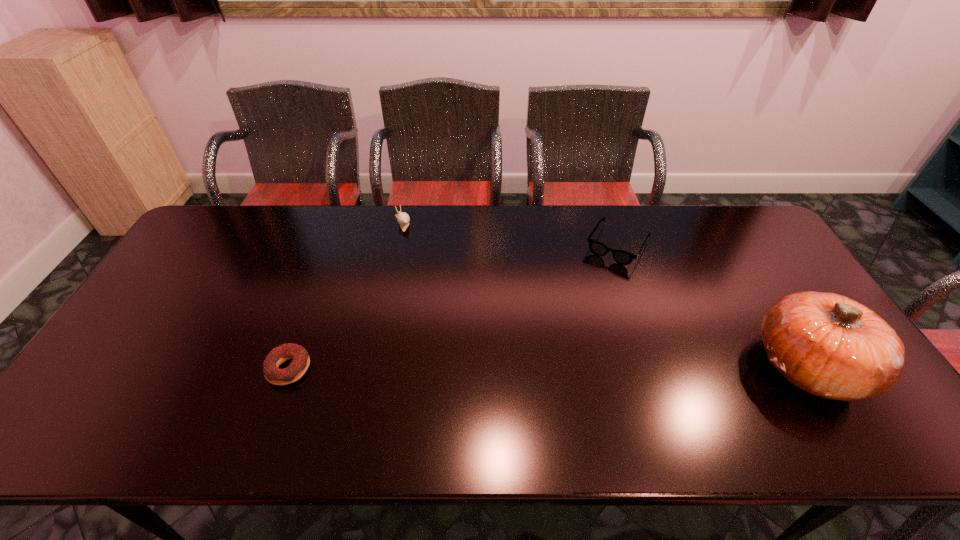
Find the location of a particular element. This screenshot has height=540, width=960. empty space between the leftmost object and the pumpkin is located at coordinates (548, 367).

The image size is (960, 540). Find the location of `free spot between the doughnut and the second object from right to left`. free spot between the doughnut and the second object from right to left is located at coordinates (453, 307).

Locate an element on the screen. This screenshot has height=540, width=960. free space between the escargot and the leftmost object is located at coordinates (346, 295).

You are a GUI agent. You are given a task and a screenshot of the screen. Output one action in this format:
    pyautogui.click(x=<x>, y=<y>)
    Task: Click on the vacant space in between the leftmost object and the pumpkin
    The height and width of the screenshot is (540, 960).
    Given the screenshot: What is the action you would take?
    pyautogui.click(x=548, y=367)

At what (x,y) coordinates should I click in order to perform the action: click on free space between the spectacles and the leftmost object. Please return your answer as a coordinate pair (x, y). This screenshot has height=540, width=960. Looking at the image, I should click on (453, 307).

Locate which object is the third closest to the leftmost object. Please provide its 2D coordinates. Your answer should be formatted as a tuple, i.e. [(x, y)], where the tuple contains the x and y coordinates of a point satisfying the conditions above.

[(831, 346)]

Where is `object that stands as the second closest to the second object from left to right`? The height and width of the screenshot is (540, 960). object that stands as the second closest to the second object from left to right is located at coordinates (622, 257).

This screenshot has width=960, height=540. I want to click on free spot that satisfies the following two spatial constraints: 1. on the back side of the second object from right to left; 2. on the right side of the leftmost object, so click(333, 245).

Locate an element on the screen. The image size is (960, 540). vacant space that satisfies the following two spatial constraints: 1. on the back side of the leftmost object; 2. on the left side of the rightmost object is located at coordinates (290, 366).

At what (x,y) coordinates should I click in order to perform the action: click on vacant space that satisfies the following two spatial constraints: 1. on the front side of the pumpkin; 2. on the left side of the escargot. Please return your answer as a coordinate pair (x, y). This screenshot has height=540, width=960. Looking at the image, I should click on (373, 366).